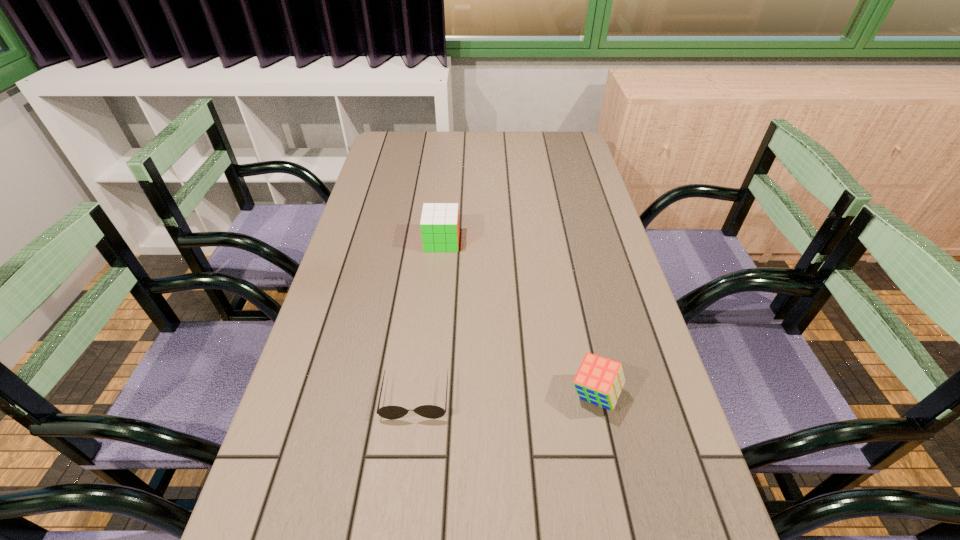
Where is `free spot between the shortest object and the farthest object`? This screenshot has height=540, width=960. free spot between the shortest object and the farthest object is located at coordinates (428, 319).

Identify the location of vacant space that's between the sunglasses and the farthest object. This screenshot has height=540, width=960. (428, 319).

You are a GUI agent. You are given a task and a screenshot of the screen. Output one action in this format:
    pyautogui.click(x=<x>, y=<y>)
    Task: Click on the empty location between the sunglasses and the farthest object
    
    Given the screenshot: What is the action you would take?
    pyautogui.click(x=428, y=319)

Locate which object is the closest to the shortest object. Please provide its 2D coordinates. Your answer should be formatted as a tuple, i.e. [(x, y)], where the tuple contains the x and y coordinates of a point satisfying the conditions above.

[(599, 380)]

In order to click on the second closest object to the farthest object in this screenshot , I will do `click(599, 380)`.